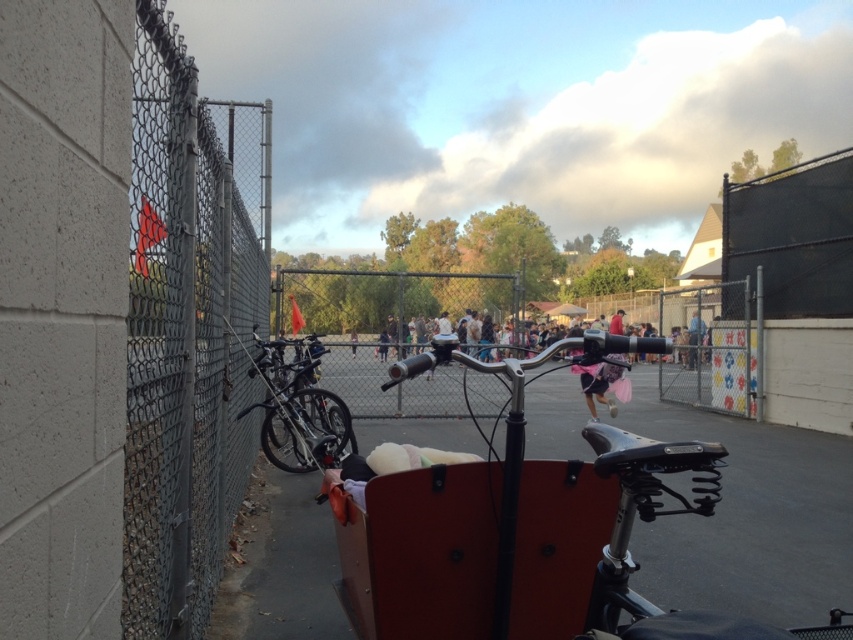
You are standing in the middle of the scene and want to walk towards the black mesh fence at upper right and the shiny black bicycle at left. Which object will you reach first?

You will reach the black mesh fence at upper right first because it is closer to you than the shiny black bicycle at left.

You are a painter who wants to paint the black mesh fence at upper right and the shiny black bicycle at left. Given that the fence is smaller than the bicycle, which object would require more paint to cover its surface?

The shiny black bicycle at left would require more paint because it is larger than the black mesh fence at upper right.